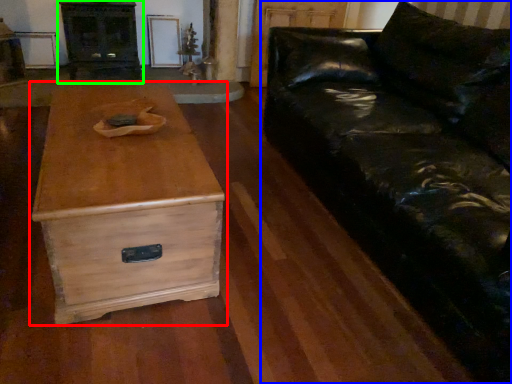
Question: Based on their relative distances, which object is nearer to chest of drawers (highlighted by a red box)? Choose from studio couch (highlighted by a blue box) and entertainment center (highlighted by a green box).

Choices:
 (A) studio couch
 (B) entertainment center

Answer: (A)